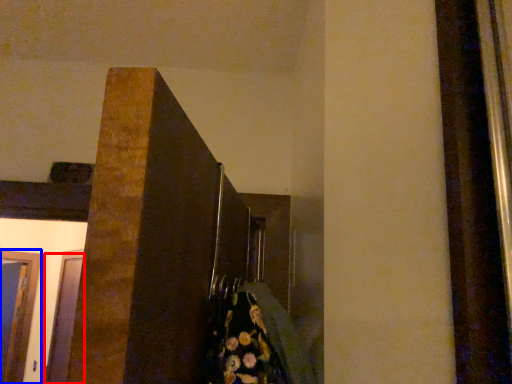
Question: Which of the following is the closest to the observer, glass door (highlighted by a red box) or glass door (highlighted by a blue box)?

Choices:
 (A) glass door
 (B) glass door

Answer: (A)